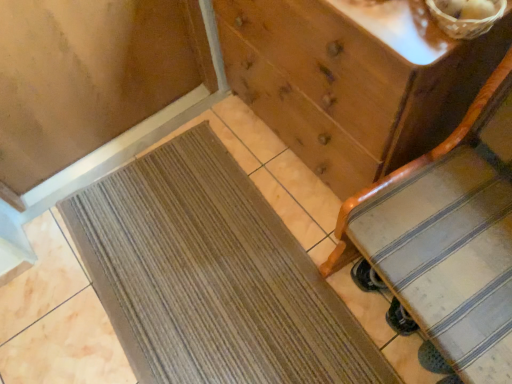
You are a GUI agent. You are given a task and a screenshot of the screen. Output one action in this format:
    pyautogui.click(x=<x>, y=<y>)
    Task: Click on the free space to the left of brown woven basket at upper right
    
    Given the screenshot: What is the action you would take?
    pyautogui.click(x=404, y=31)